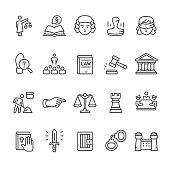
What are the coordinates of `law book` in the screenshot? It's located at (89, 65).